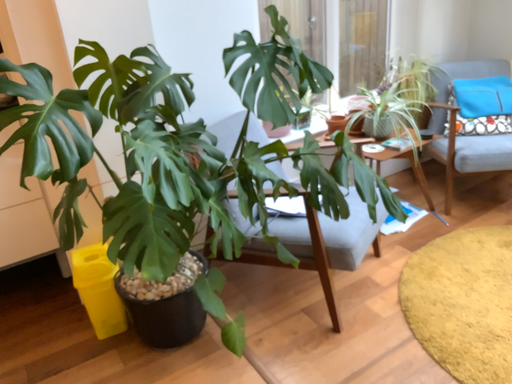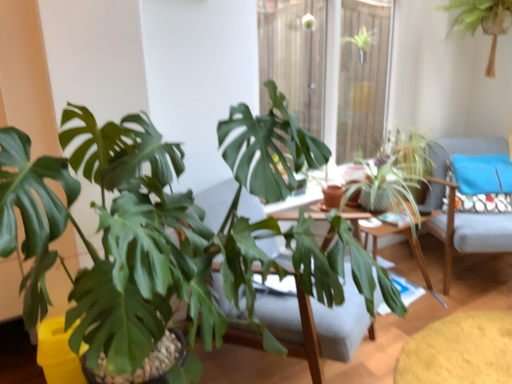
Question: How did the camera likely rotate when shooting the video?

Choices:
 (A) rotated downward
 (B) rotated upward

Answer: (B)